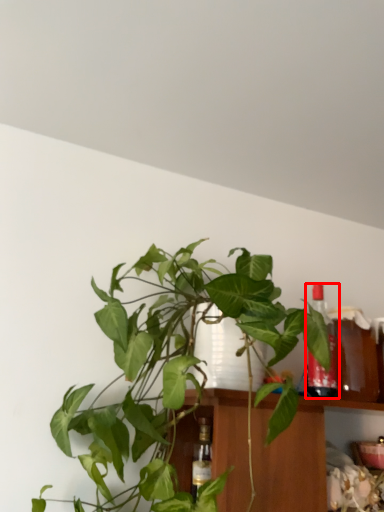
Question: Considering the relative positions of bottle (annotated by the red box) and houseplant in the image provided, where is bottle (annotated by the red box) located with respect to the staircase?

Choices:
 (A) left
 (B) right

Answer: (B)